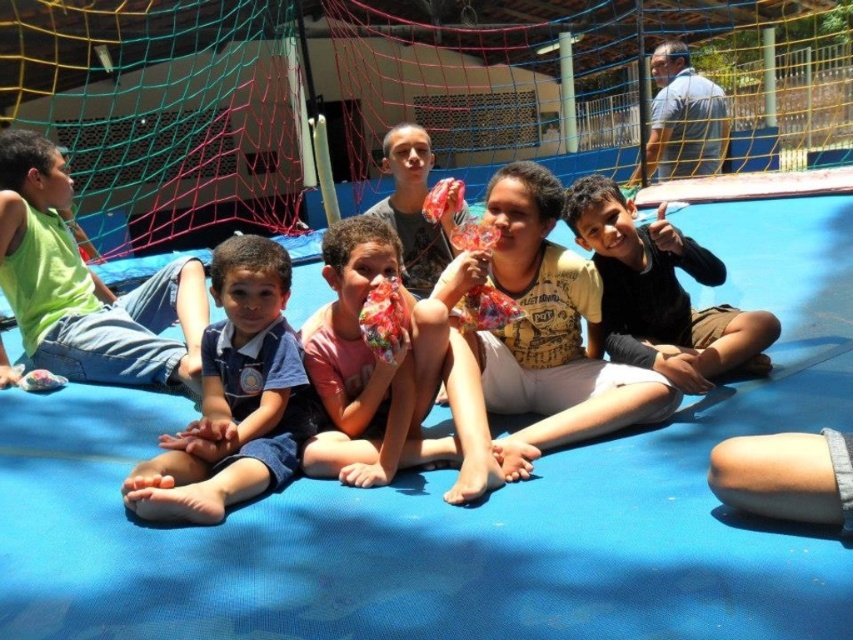
Does blue rubber mat at center appear under yellow mesh net at upper center?

Yes, blue rubber mat at center is below yellow mesh net at upper center.

Which is in front, point (502, 512) or point (372, 93)?

Positioned in front is point (502, 512).

Which is behind, point (838, 570) or point (573, 163)?

Positioned behind is point (573, 163).

At what (x,y) coordinates should I click in order to perform the action: click on blue rubber mat at center. Please return your answer as a coordinate pair (x, y). Looking at the image, I should click on (460, 506).

Between blue rubber mat at center and blue denim shorts at left, which one appears on the left side from the viewer's perspective?

Positioned to the left is blue denim shorts at left.

Which is below, blue rubber mat at center or blue denim shorts at left?

blue rubber mat at center is below.

Who is more distant from viewer, (686, 573) or (241, 250)?

Point (241, 250)

Locate an element on the screen. The image size is (853, 640). blue rubber mat at center is located at coordinates (460, 506).

Who is positioned more to the right, blue rubber mat at center or green matte shirt at left?

From the viewer's perspective, blue rubber mat at center appears more on the right side.

Can you confirm if blue rubber mat at center is positioned to the left of green matte shirt at left?

No, blue rubber mat at center is not to the left of green matte shirt at left.

Which is in front, point (799, 314) or point (125, 324)?

Point (125, 324)

You are a GUI agent. You are given a task and a screenshot of the screen. Output one action in this format:
    pyautogui.click(x=<x>, y=<y>)
    Task: Click on the blue rubber mat at center
    The height and width of the screenshot is (640, 853).
    Given the screenshot: What is the action you would take?
    pyautogui.click(x=460, y=506)